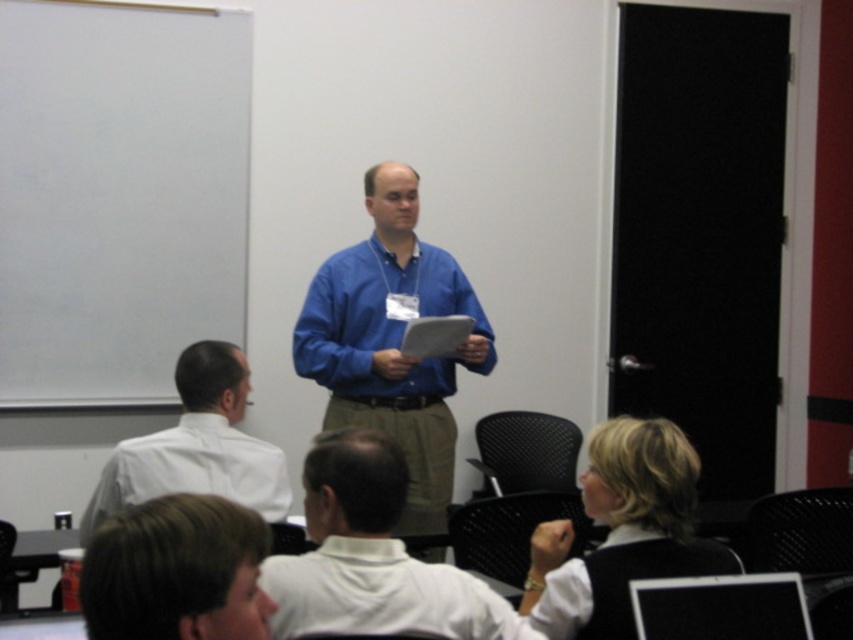
Describe the element at coordinates (642, 483) in the screenshot. This screenshot has height=640, width=853. I see `black fabric vest at lower right` at that location.

Can you confirm if black fabric vest at lower right is wider than white shirt at left?

In fact, black fabric vest at lower right might be narrower than white shirt at left.

Does point (584, 572) lie behind point (209, 451)?

No, (584, 572) is closer to viewer.

Find the location of `black fabric vest at lower right`. black fabric vest at lower right is located at coordinates (642, 483).

Which is below, blue fabric shirt at center or brown hair at lower center?

brown hair at lower center is lower down.

Does blue fabric shirt at center have a greater width compared to brown hair at lower center?

Correct, the width of blue fabric shirt at center exceeds that of brown hair at lower center.

Is point (440, 397) behind point (108, 580)?

Yes, point (440, 397) is farther from viewer.

At what (x,y) coordinates should I click in order to perform the action: click on blue fabric shirt at center. Please return your answer as a coordinate pair (x, y). Looking at the image, I should click on (392, 340).

Is blue fabric shirt at center to the left of white shirt at left from the viewer's perspective?

No, blue fabric shirt at center is not to the left of white shirt at left.

Measure the distance between blue fabric shirt at center and camera.

blue fabric shirt at center and camera are 7.97 feet apart from each other.

Between point (434, 401) and point (236, 353), which one is positioned behind?

The point (434, 401) is behind.

Where is `blue fabric shirt at center`? The height and width of the screenshot is (640, 853). blue fabric shirt at center is located at coordinates (392, 340).